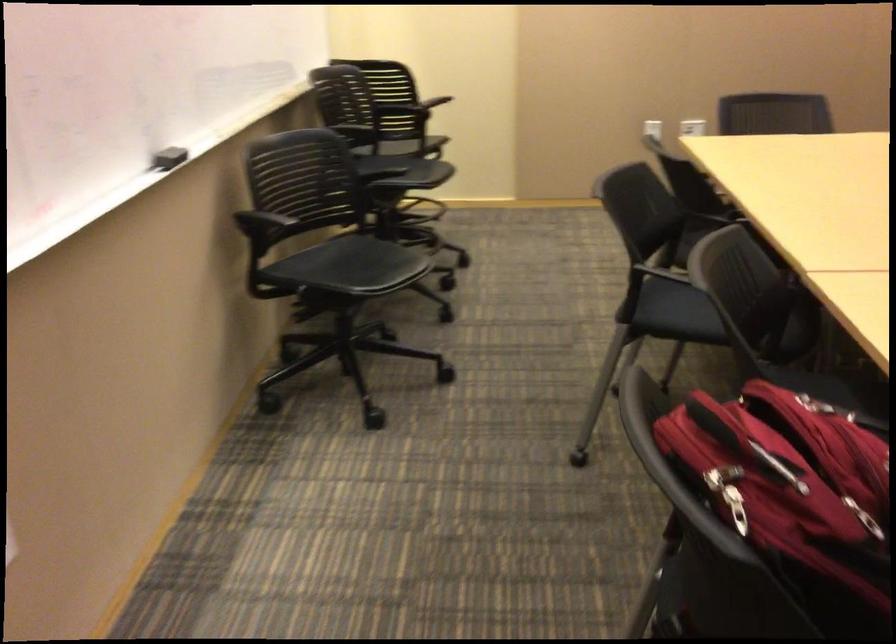
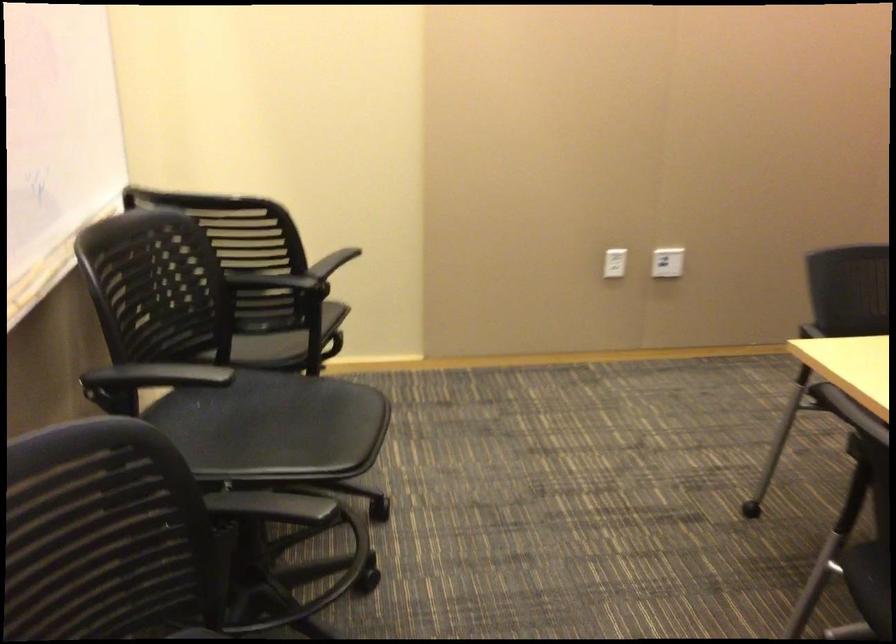
Find the pixel in the second image that matches (659,126) in the first image.

(615, 263)